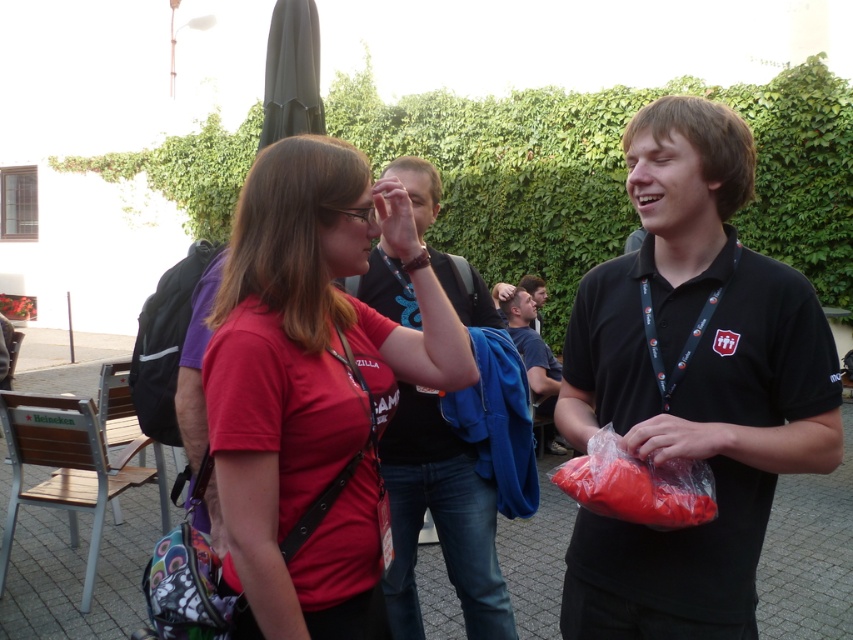
Question: Which point appears closest to the camera in this image?

Choices:
 (A) (776, 328)
 (B) (386, 598)

Answer: (A)

Question: Does black cotton shirt at center appear over translucent plastic bag at center?

Choices:
 (A) no
 (B) yes

Answer: (A)

Question: Is black matte shirt at center smaller than translucent plastic bag at center?

Choices:
 (A) no
 (B) yes

Answer: (A)

Question: Is black matte shirt at center positioned in front of dark blue fabric jacket at center?

Choices:
 (A) yes
 (B) no

Answer: (A)

Question: Which of the following is the closest to the observer?

Choices:
 (A) matte red shirt at center
 (B) translucent plastic bag at center
 (C) black cotton shirt at center

Answer: (A)

Question: Which object is positioned closest to the black matte shirt at center?

Choices:
 (A) matte red shirt at center
 (B) translucent plastic bag at center
 (C) black cotton shirt at center

Answer: (B)